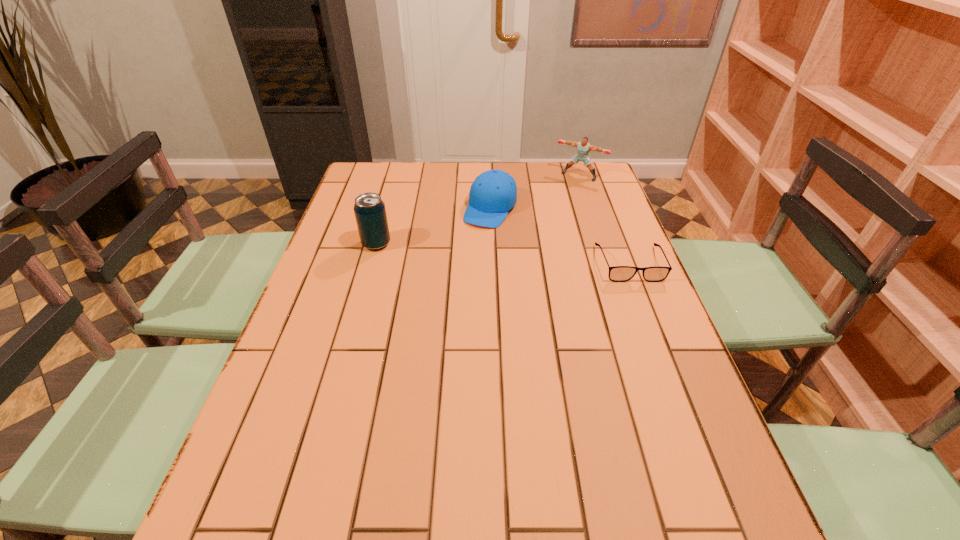
This screenshot has width=960, height=540. I want to click on free spot between the shortest object and the soda can, so click(x=503, y=253).

What are the coordinates of `vacant area that lies between the farthest object and the cap` in the screenshot? It's located at (535, 192).

At what (x,y) coordinates should I click in order to perform the action: click on free area in between the shortest object and the third tallest object. Please return your answer as a coordinate pair (x, y). Looking at the image, I should click on (561, 236).

The width and height of the screenshot is (960, 540). In order to click on free spot between the second shortest object and the shortest object in this screenshot , I will do `click(561, 236)`.

Locate an element on the screen. The image size is (960, 540). object that is the third closest to the puncher is located at coordinates (369, 209).

Locate an element on the screen. This screenshot has height=540, width=960. the closest object relative to the puncher is located at coordinates (493, 193).

Where is `free point that satisfies the following two spatial constraints: 1. on the back side of the puncher; 2. on the right side of the leftmost object`? Image resolution: width=960 pixels, height=540 pixels. free point that satisfies the following two spatial constraints: 1. on the back side of the puncher; 2. on the right side of the leftmost object is located at coordinates (396, 176).

Where is `vacant space that satisfies the following two spatial constraints: 1. on the back side of the third tallest object; 2. on the left side of the puncher`? The height and width of the screenshot is (540, 960). vacant space that satisfies the following two spatial constraints: 1. on the back side of the third tallest object; 2. on the left side of the puncher is located at coordinates (490, 176).